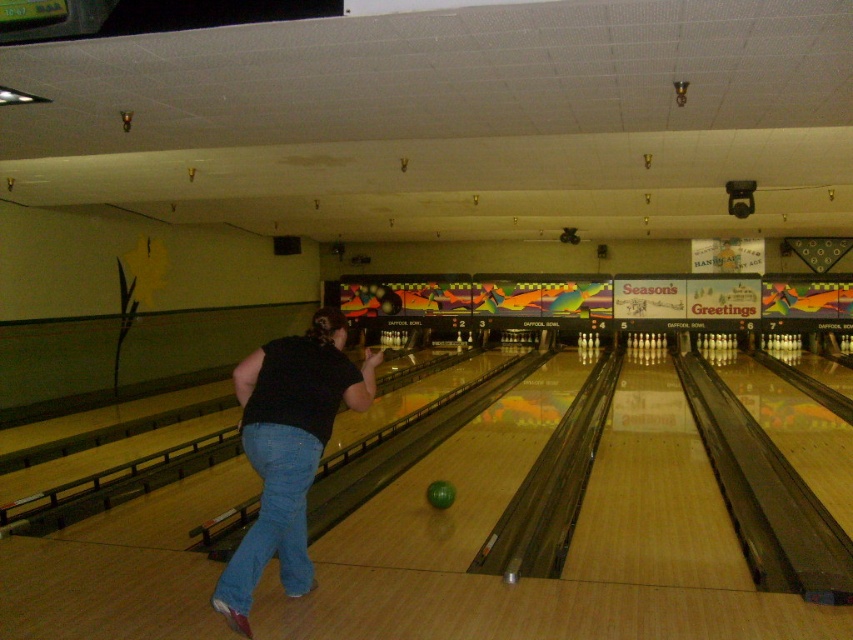
Question: Does denim at left come behind green matte bowling ball at center?

Choices:
 (A) yes
 (B) no

Answer: (B)

Question: Which point is closer to the camera?

Choices:
 (A) (271, 340)
 (B) (285, 433)
 (C) (437, 493)

Answer: (B)

Question: Which object appears closest to the camera in this image?

Choices:
 (A) green matte bowling ball at center
 (B) black cotton shirt at center
 (C) denim at left

Answer: (C)

Question: Is black cotton shirt at center below denim at left?

Choices:
 (A) yes
 (B) no

Answer: (B)

Question: Where is denim at left located in relation to green matte bowling ball at center in the image?

Choices:
 (A) right
 (B) left

Answer: (B)

Question: Among these objects, which one is farthest from the camera?

Choices:
 (A) green matte bowling ball at center
 (B) denim at left
 (C) black cotton shirt at center

Answer: (A)